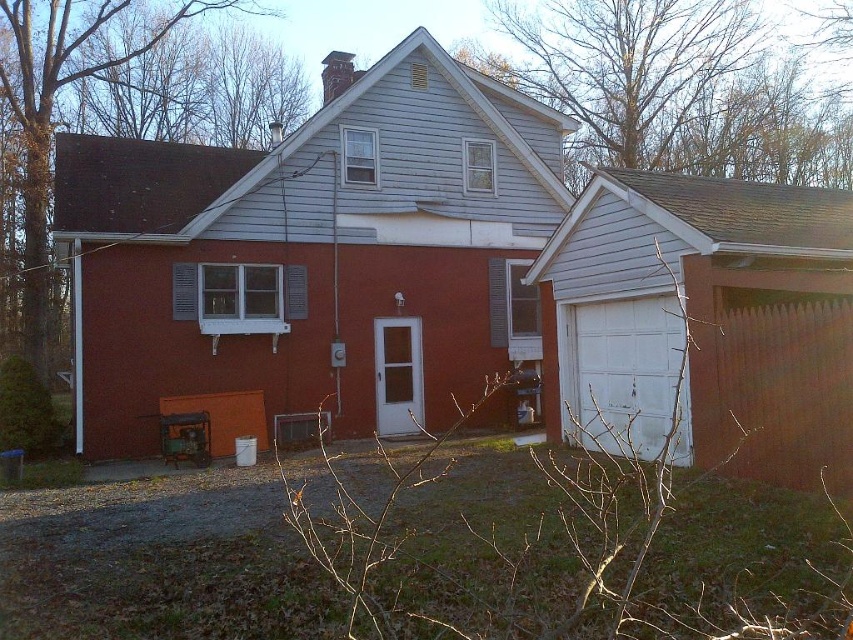
What is the color of the surface where the point at coordinates (312,253) is located?

The point at coordinates (312,253) is located on the smooth red shed at center, so the color is red.

You are a delivery person trying to park your van in front of the house. The van is 2 meters wide. The space between the smooth red shed at center and the white matte garage door at right is 3 meters. Can your van fit in that space?

The space between the smooth red shed at center and the white matte garage door at right is 3 meters. Since the van is 2 meters wide, it can fit in the space.